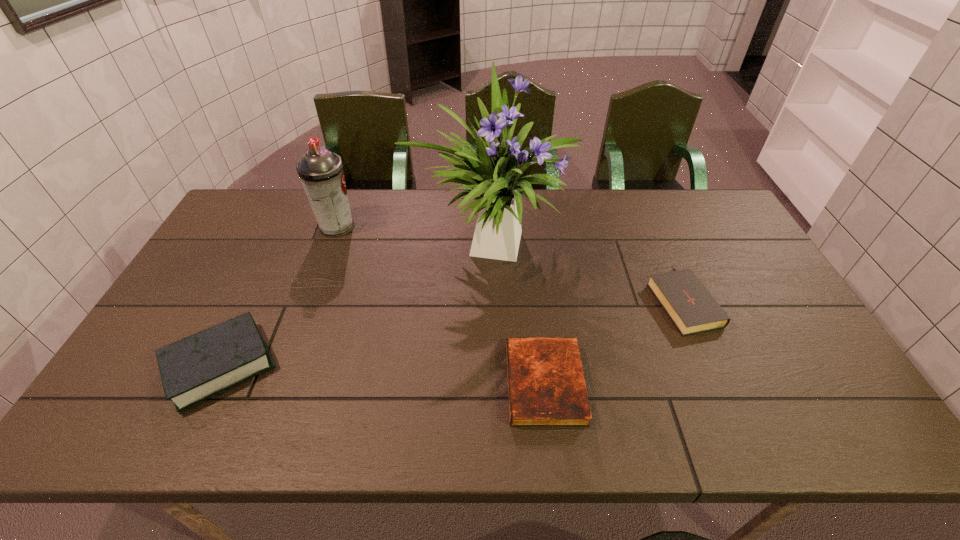
Image resolution: width=960 pixels, height=540 pixels. Find the location of `free space between the fourth shortest object and the rightmost object`. free space between the fourth shortest object and the rightmost object is located at coordinates (510, 263).

Where is `vacant space that's between the flower arrangement and the second Bible from right to left`? Image resolution: width=960 pixels, height=540 pixels. vacant space that's between the flower arrangement and the second Bible from right to left is located at coordinates (517, 314).

Identify the location of object that is the third closest to the flower arrangement. The image size is (960, 540). (690, 306).

At what (x,y) coordinates should I click in order to perform the action: click on object that ranks as the third closest to the fourth shortest object. Please return your answer as a coordinate pair (x, y). The width and height of the screenshot is (960, 540). Looking at the image, I should click on (546, 388).

Identify the location of Bible that can be found as the closest to the rightmost Bible. (546, 388).

At what (x,y) coordinates should I click in order to perform the action: click on Bible that is the closest to the rightmost object. Please return your answer as a coordinate pair (x, y). This screenshot has height=540, width=960. Looking at the image, I should click on (546, 388).